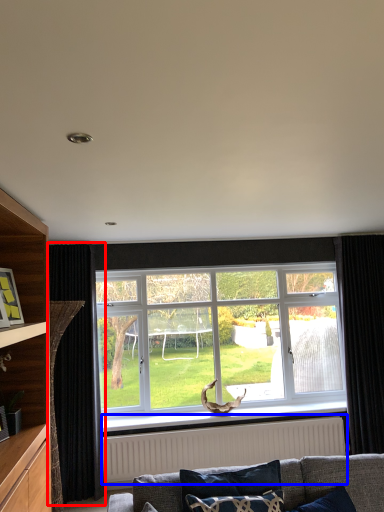
Question: Which point is closer to the camera, curtain (highlighted by a red box) or radiator (highlighted by a blue box)?

Choices:
 (A) curtain
 (B) radiator

Answer: (A)